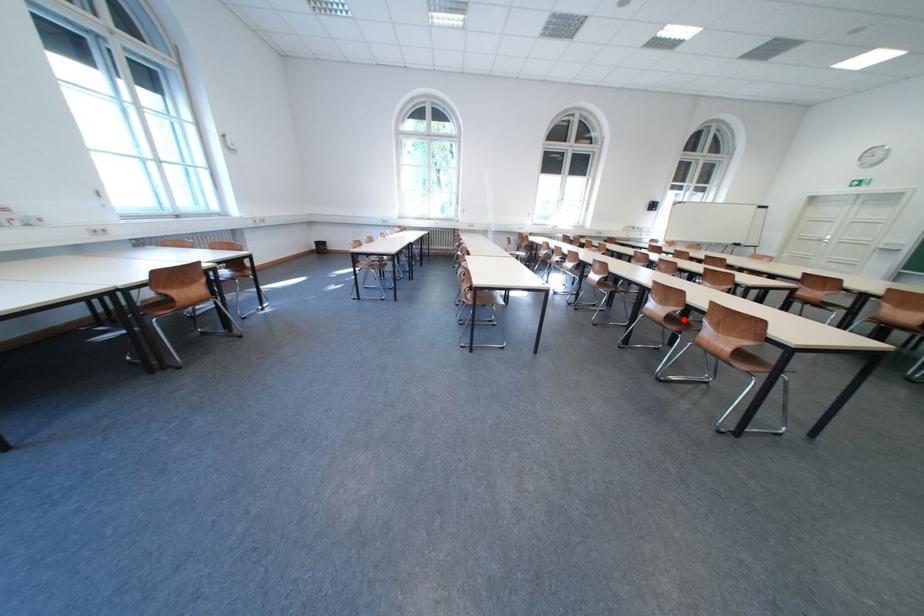
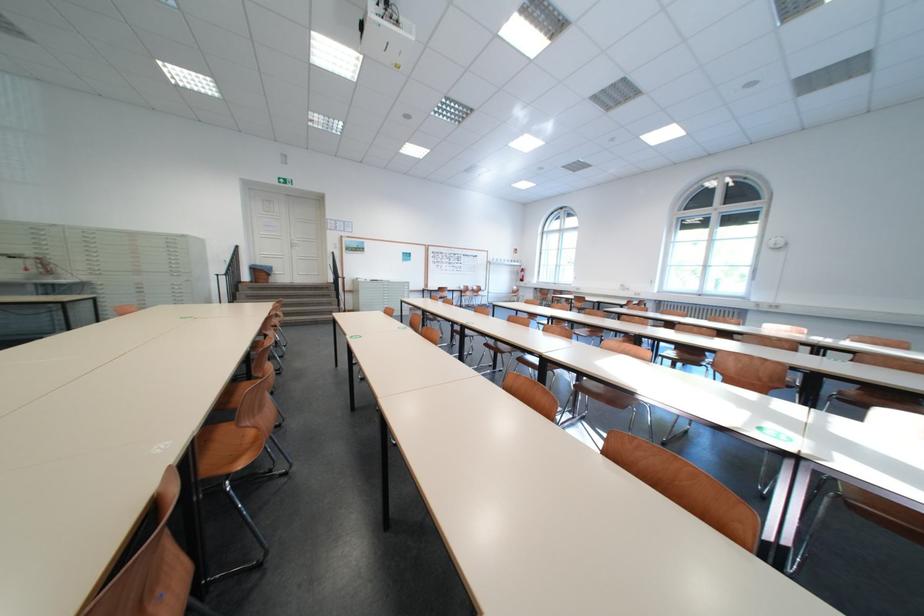
Question: I am providing you with two images of the same scene from different viewpoints. A red point is marked on the first image. At the location where the point appears in image 1, is it still visible in image 2?

Choices:
 (A) Yes
 (B) No

Answer: (B)